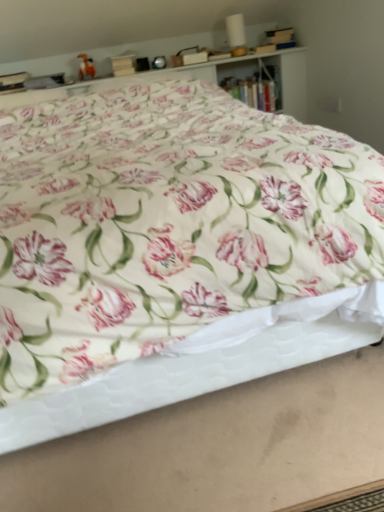
I want to click on empty space that is ontop of white quilted mattress at lower center (from a real-world perspective), so click(244, 455).